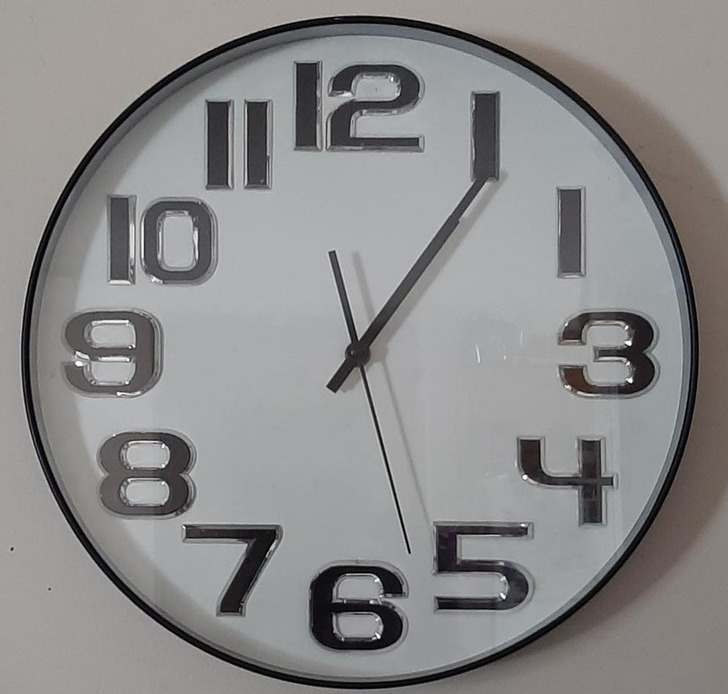
Where is `clock face`? Image resolution: width=728 pixels, height=694 pixels. clock face is located at coordinates (250, 423).